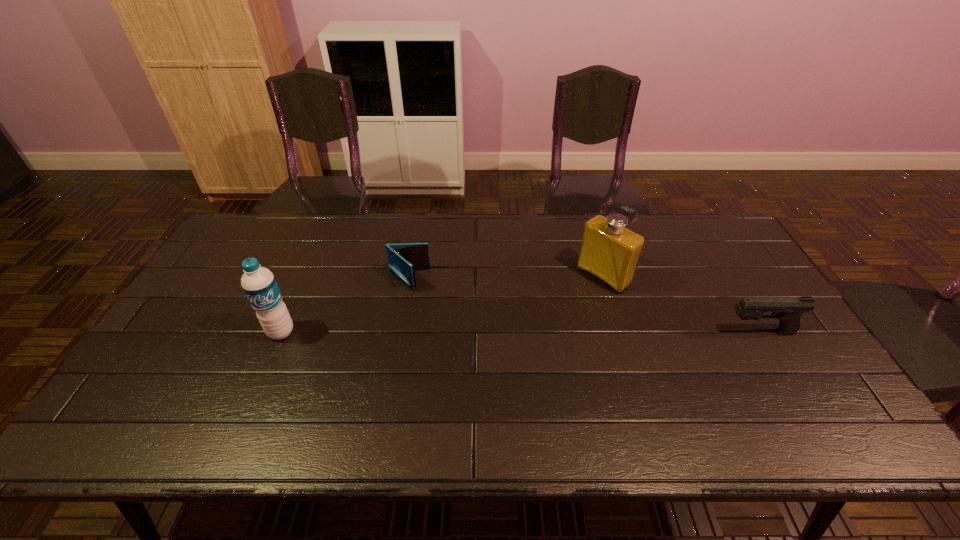
Where is `free spot located 0.080m on the exterior surface of the shortest object`? The width and height of the screenshot is (960, 540). free spot located 0.080m on the exterior surface of the shortest object is located at coordinates (439, 302).

The height and width of the screenshot is (540, 960). Find the location of `vacant space situated 0.090m on the exterior surface of the shortest object`. vacant space situated 0.090m on the exterior surface of the shortest object is located at coordinates (442, 304).

At what (x,y) coordinates should I click in order to perform the action: click on vacant space situated on the exterior surface of the shortest object. Please return your answer as a coordinate pair (x, y). This screenshot has height=540, width=960. Looking at the image, I should click on (474, 330).

The height and width of the screenshot is (540, 960). Identify the location of blank area located on the front-facing side of the second object from right to left. (526, 335).

Identify the location of vacant area located on the front-facing side of the second object from right to left. (562, 308).

Find the location of a particular element. free space located 0.380m on the front-facing side of the second object from right to left is located at coordinates (496, 357).

At what (x,y) coordinates should I click in order to perform the action: click on object at the right edge. Please return your answer as a coordinate pair (x, y). Looking at the image, I should click on (789, 310).

Locate an element on the screen. The height and width of the screenshot is (540, 960). blank space at the far edge of the desktop is located at coordinates (306, 232).

Find the location of a particular element. vacant space at the near edge of the desktop is located at coordinates (691, 385).

What are the coordinates of `free space at the left edge of the desktop` in the screenshot? It's located at (232, 319).